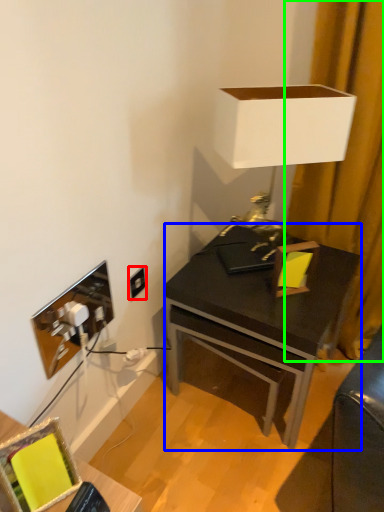
Question: Which object is positioned closest to power outlet (highlighted by a red box)? Select from desk (highlighted by a blue box) and curtain (highlighted by a green box).

Choices:
 (A) desk
 (B) curtain

Answer: (A)